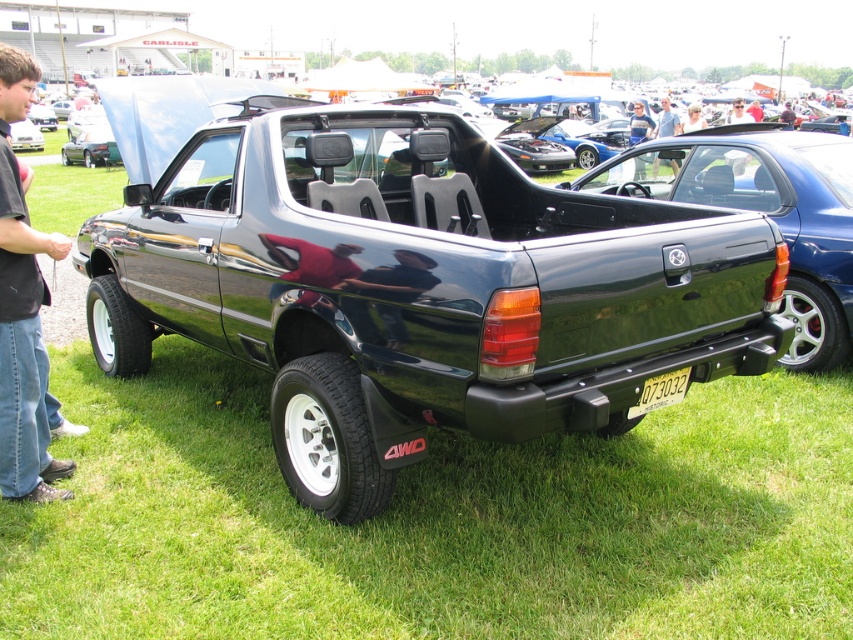
Question: From the image, what is the correct spatial relationship of jeans at left in relation to yellow metallic license plate at center?

Choices:
 (A) left
 (B) right

Answer: (A)

Question: Among these points, which one is nearest to the camera?

Choices:
 (A) (747, 120)
 (B) (830, 236)
 (C) (633, 132)
 (D) (9, 496)

Answer: (D)

Question: Is yellow metallic license plate at center to the left of blue jeans at center from the viewer's perspective?

Choices:
 (A) yes
 (B) no

Answer: (A)

Question: Which point appears closest to the camera in this image?

Choices:
 (A) (743, 115)
 (B) (671, 125)

Answer: (B)

Question: Based on their relative distances, which object is nearer to the light brown leather jacket at center?

Choices:
 (A) gray fabric shirt at upper center
 (B) yellow metallic license plate at center

Answer: (A)

Question: In this image, where is yellow metallic license plate at center located relative to light brown leather jacket at center?

Choices:
 (A) left
 (B) right

Answer: (A)